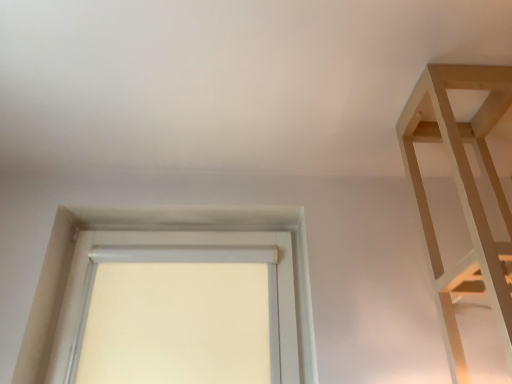
Question: In the image, is white fabric window at center positioned in front of or behind light wood shelf at upper right?

Choices:
 (A) front
 (B) behind

Answer: (B)

Question: Considering the positions of point (70, 314) and point (442, 314), is point (70, 314) closer or farther from the camera than point (442, 314)?

Choices:
 (A) closer
 (B) farther

Answer: (B)

Question: From the image's perspective, is white fabric window at center located above or below light wood shelf at upper right?

Choices:
 (A) above
 (B) below

Answer: (B)

Question: In terms of size, does light wood shelf at upper right appear bigger or smaller than white fabric window at center?

Choices:
 (A) big
 (B) small

Answer: (A)

Question: Is light wood shelf at upper right inside the boundaries of white fabric window at center, or outside?

Choices:
 (A) outside
 (B) inside

Answer: (A)

Question: Looking at their shapes, would you say light wood shelf at upper right is wider or thinner than white fabric window at center?

Choices:
 (A) wide
 (B) thin

Answer: (A)

Question: Is light wood shelf at upper right taller or shorter than white fabric window at center?

Choices:
 (A) tall
 (B) short

Answer: (A)